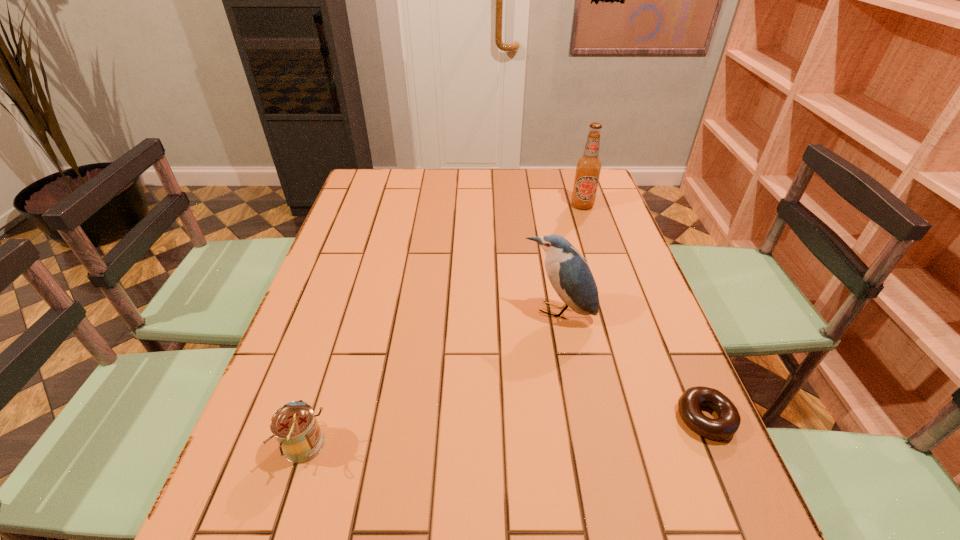
Where is `vacant spot on the desktop that is between the leftmost object and the shortest object and is positioned on the front label of the second object from right to left`? The image size is (960, 540). vacant spot on the desktop that is between the leftmost object and the shortest object and is positioned on the front label of the second object from right to left is located at coordinates (524, 431).

Locate an element on the screen. This screenshot has height=540, width=960. free space on the desktop that is between the second shortest object and the rightmost object and is positioned at the tip of the second farthest object's beak is located at coordinates (505, 432).